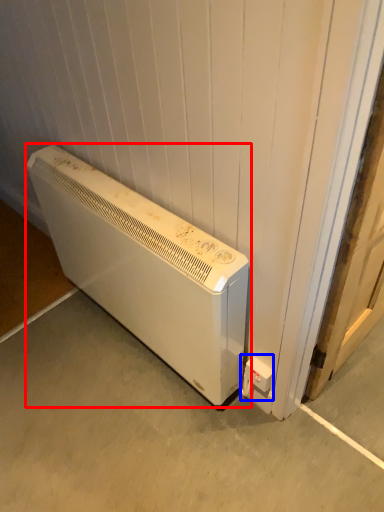
Question: Which object is further to the camera taking this photo, home appliance (highlighted by a red box) or electric outlet (highlighted by a blue box)?

Choices:
 (A) home appliance
 (B) electric outlet

Answer: (B)